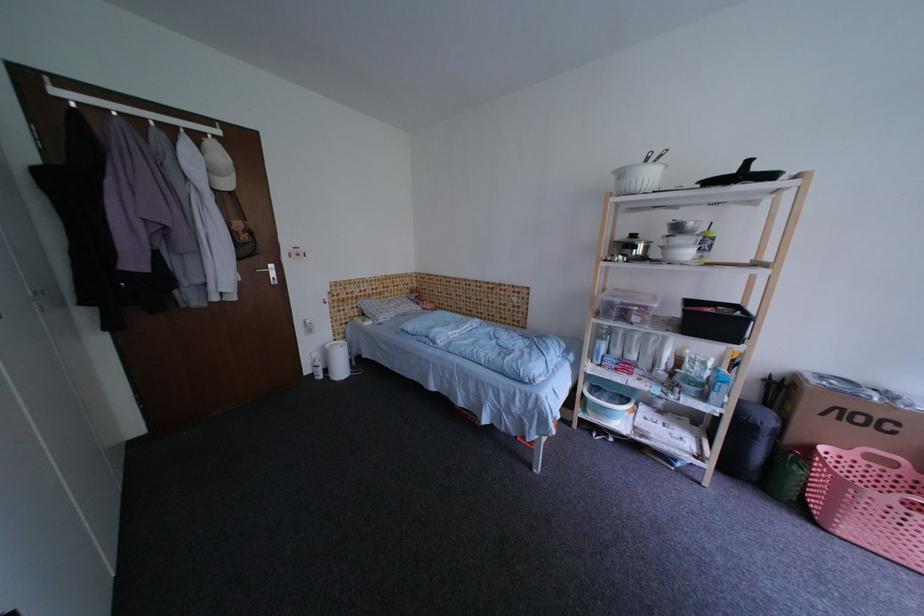
Find where to lift the bucket handle. Please return your answer as a coordinate pair (x, y).

(648, 156)